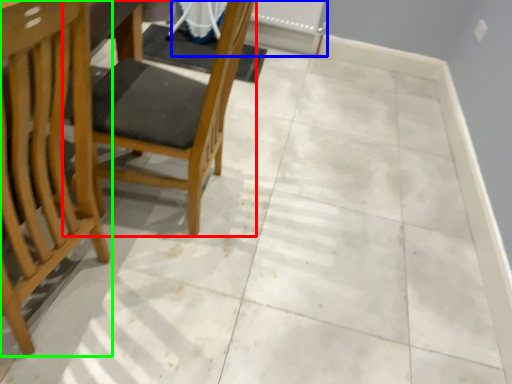
Question: Which object is the farthest from chair (highlighted by a red box)? Choose among these: radiator (highlighted by a blue box) or chair (highlighted by a green box).

Choices:
 (A) radiator
 (B) chair

Answer: (A)